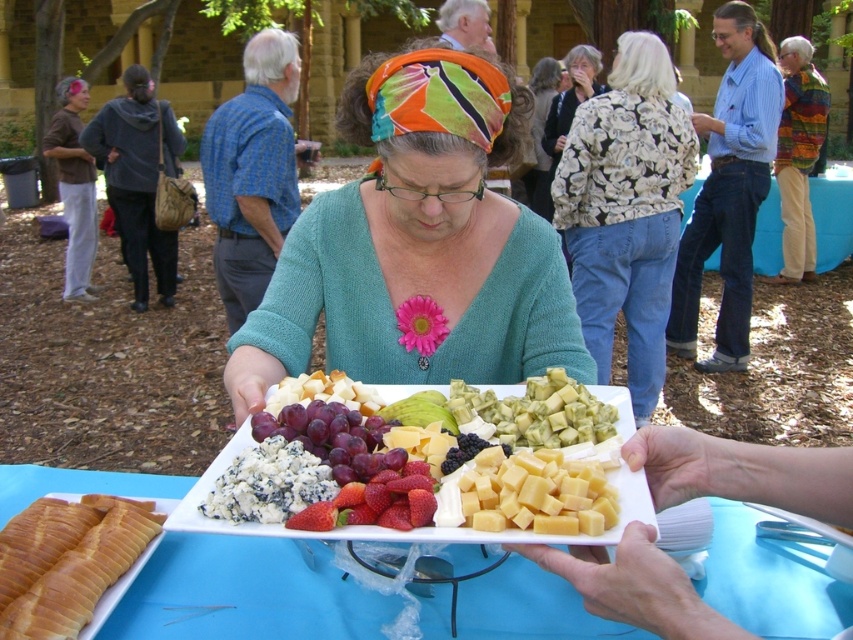
Based on the photo, you are a guest at this outdoor gathering and you want to grab a snack. There are blue crumbly cheese at center and ripe red strawberries at center. Which one is located higher?

The blue crumbly cheese at center is above the ripe red strawberries at center, so it is located higher.